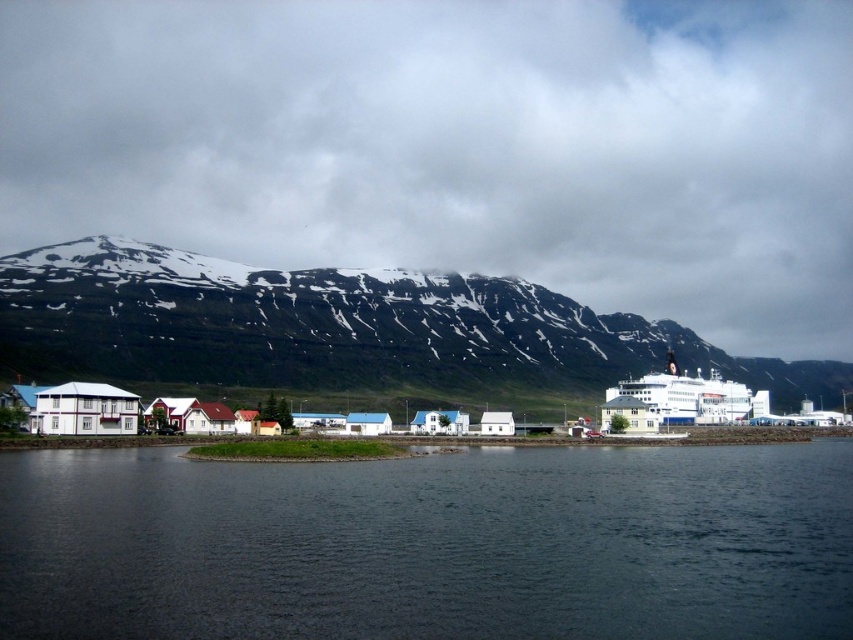
Does white fluffy cloud at upper center appear under green grassy mountain at upper center?

Incorrect, white fluffy cloud at upper center is not positioned below green grassy mountain at upper center.

Who is more distant from viewer, (270,179) or (192,372)?

The point (270,179) is behind.

Between point (367, 168) and point (163, 348), which one is positioned behind?

Point (367, 168)

This screenshot has height=640, width=853. In order to click on white fluffy cloud at upper center in this screenshot , I will do `click(457, 145)`.

Can you confirm if dark blue water at center is wider than white matte ferry at right?

Correct, the width of dark blue water at center exceeds that of white matte ferry at right.

Can you confirm if dark blue water at center is positioned below white matte ferry at right?

Indeed, dark blue water at center is positioned under white matte ferry at right.

Locate an element on the screen. The width and height of the screenshot is (853, 640). dark blue water at center is located at coordinates [x=430, y=545].

Who is positioned more to the right, white fluffy cloud at upper center or dark blue water at center?

From the viewer's perspective, white fluffy cloud at upper center appears more on the right side.

Between point (628, 131) and point (219, 518), which one is positioned in front?

Point (219, 518)

The width and height of the screenshot is (853, 640). I want to click on white fluffy cloud at upper center, so click(457, 145).